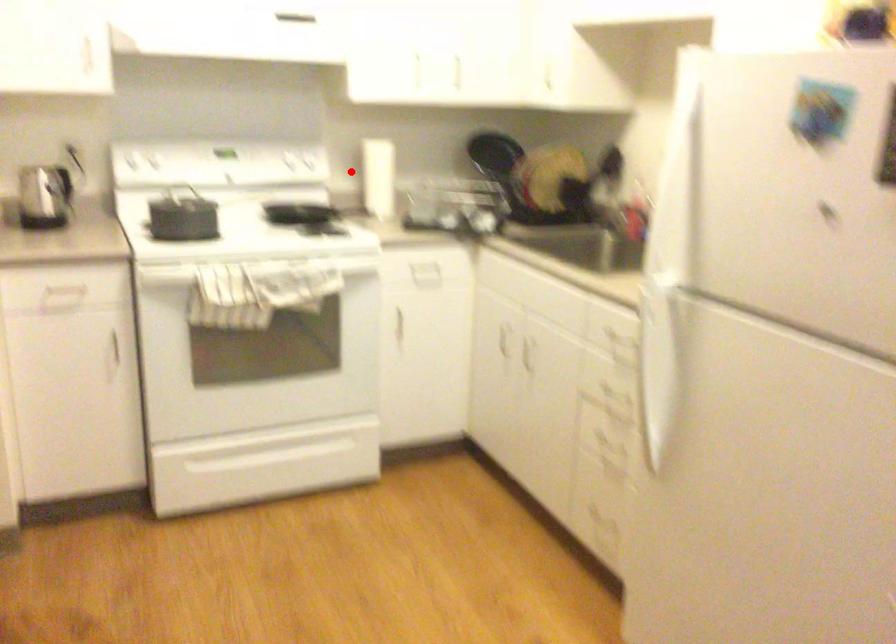
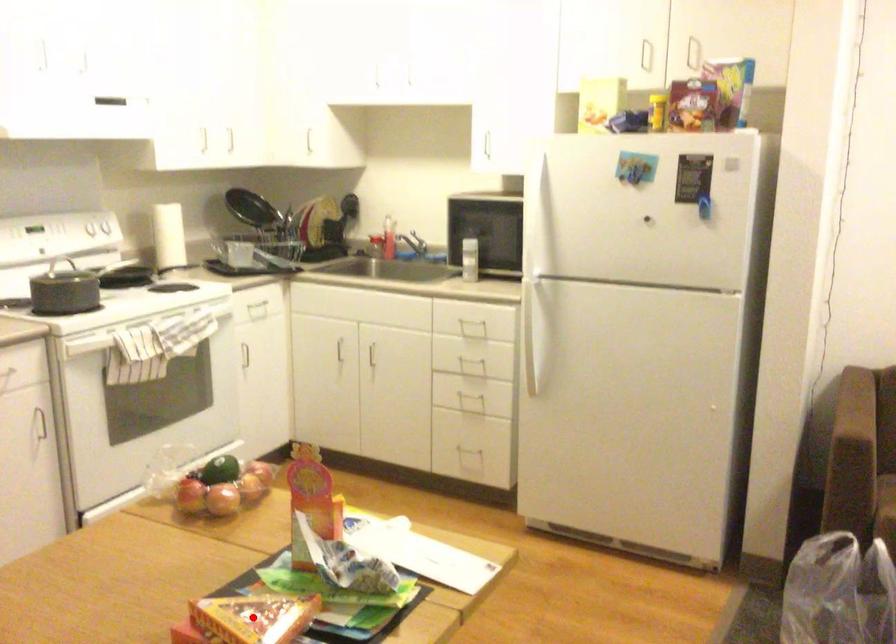
I am providing you with two images of the same scene from different viewpoints. A red point is marked on the first image and another point is marked on the second image. Is the red point in image1 aligned with the point shown in image2?

No